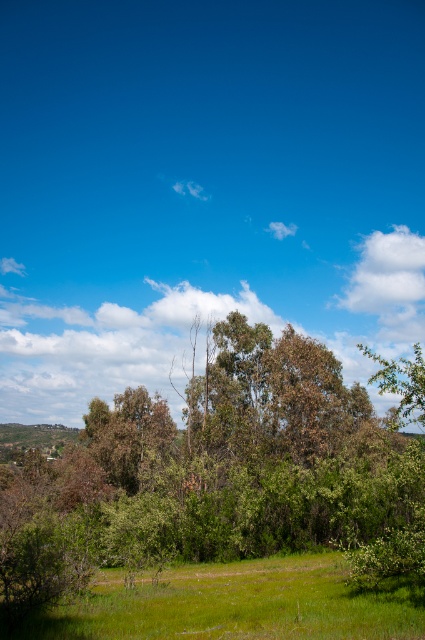
You are standing in the field looking towards the sky. Which object, the green leafy tree at center or the white fluffy cloud at upper right, is positioned to the left when viewed from your perspective?

The green leafy tree at center is positioned to the left of the white fluffy cloud at upper right.

You are standing in the middle of the field and want to take a photo of the green leafy tree at center and the green grass at lower center. Which object should you focus on first if you want to capture both in a single frame without moving your camera?

The green leafy tree at center is much taller than the green grass at lower center, so you should focus on the green leafy tree at center first to ensure it is in frame along with the green grass at lower center.